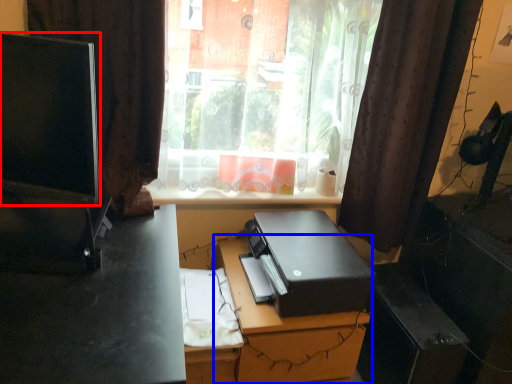
Question: Which of the following is the farthest to the observer, computer monitor (highlighted by a red box) or computer desk (highlighted by a blue box)?

Choices:
 (A) computer monitor
 (B) computer desk

Answer: (B)